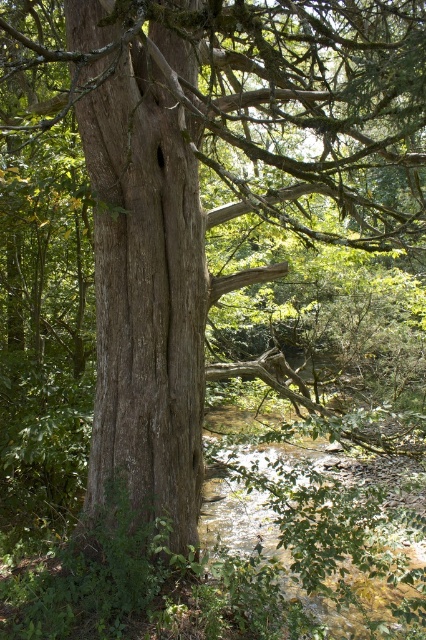
Which is above, smooth brown tree trunk at center or clear water at lower center?

A: smooth brown tree trunk at center is higher up.

Between smooth brown tree trunk at center and clear water at lower center, which one is positioned lower?

clear water at lower center

Who is more forward, [97,168] or [345,625]?

Point [97,168]

Identify the location of smooth brown tree trunk at center. The height and width of the screenshot is (640, 426). (144, 292).